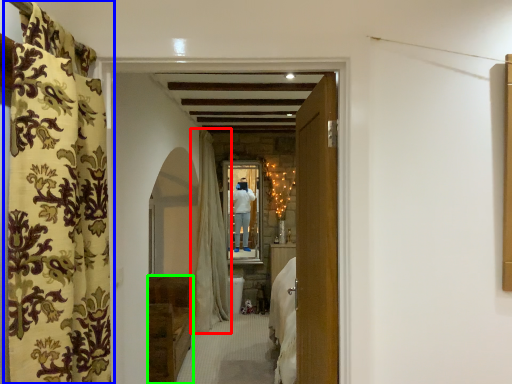
Question: Which object is the farthest from curtain (highlighted by a red box)? Choose among these: curtain (highlighted by a blue box) or furniture (highlighted by a green box).

Choices:
 (A) curtain
 (B) furniture

Answer: (A)